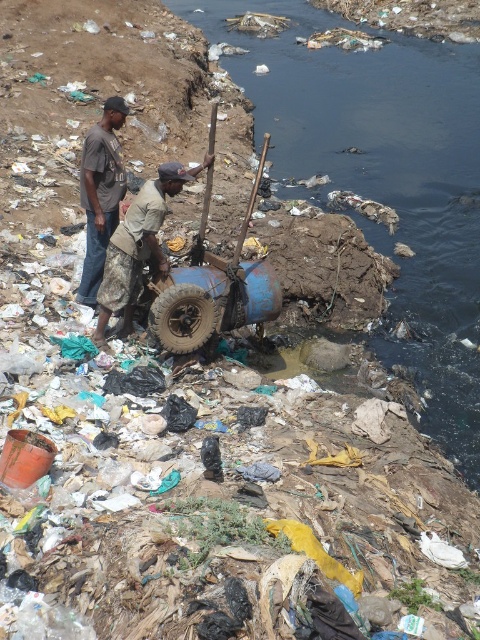
You are a waste collector who needs to retrieve the dull brown rubber tire at center without stepping into the black murky water at upper center. Based on their positions, can you safely reach the tire without getting your boots wet?

The black murky water at upper center is located above the dull brown rubber tire at center, so the water is higher than the tire. This means the tire is below the water level, so you would have to step into the water to reach it, making it impossible to retrieve the tire without getting your boots wet.